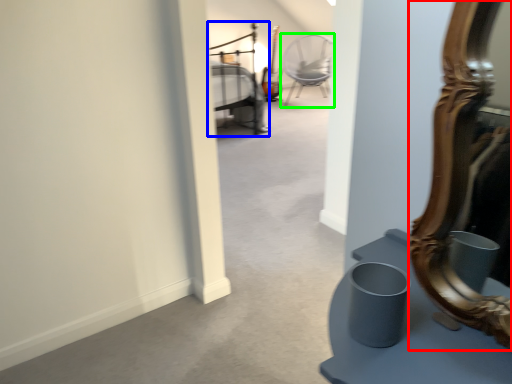
Question: Which object is positioned farthest from mirror (highlighted by a red box)? Select from bed (highlighted by a blue box) and chair (highlighted by a green box).

Choices:
 (A) bed
 (B) chair

Answer: (B)